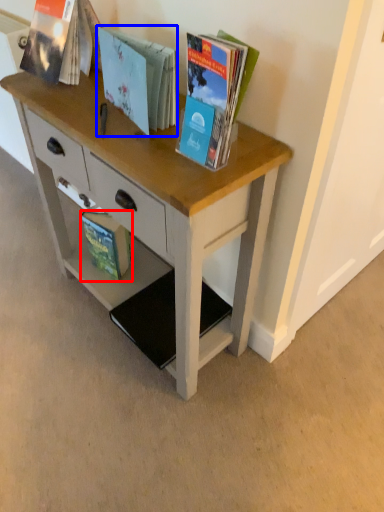
Question: Which of the following is the farthest to the observer, book (highlighted by a red box) or book (highlighted by a blue box)?

Choices:
 (A) book
 (B) book

Answer: (A)